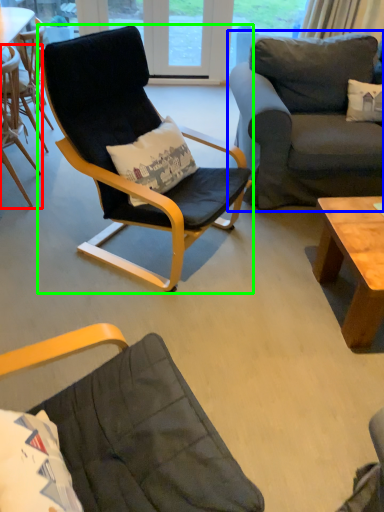
Question: Which object is the farthest from chair (highlighted by a red box)? Choose among these: studio couch (highlighted by a blue box) or chair (highlighted by a green box).

Choices:
 (A) studio couch
 (B) chair

Answer: (A)